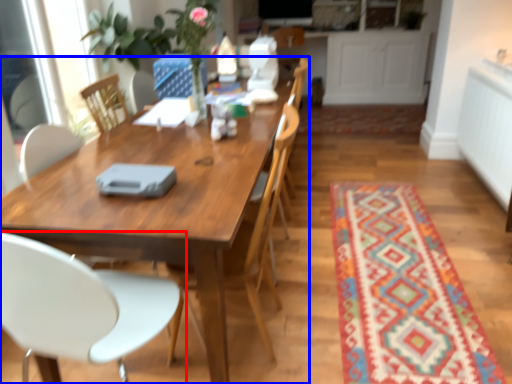
Question: Among these objects, which one is nearest to the camera, chair (highlighted by a red box) or kitchen & dining room table (highlighted by a blue box)?

Choices:
 (A) chair
 (B) kitchen & dining room table

Answer: (A)